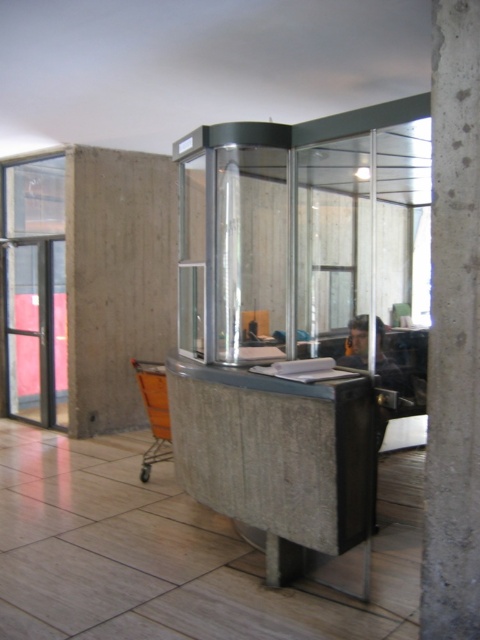
You are standing in the modern minimalist space and want to approach the glass booth. The point where you need to stand to be exactly 22.43 feet away from the booth is marked as point (28, 246). Can you confirm if this point is located to the left or right side of the booth?

The point (28, 246) is located to the left side of the booth as it is 22.43 feet away from the viewer, which matches the distance specified.

You are a delivery person carrying a large package and need to exit through the transparent glass door at left. There is an orange mesh shopping cart at lower left blocking your path. Can you walk around the shopping cart to reach the door?

The transparent glass door at left is further to the viewer than orange mesh shopping cart at lower left, meaning the shopping cart is closer to you. You can walk around the shopping cart to reach the door since the door is behind the cart.

Based on the photo, you are standing at the entrance of the reception area and want to move towards the booth. There are two points marked on the floor, point A at coordinates point(37, 298) and point B at coordinates point(169, 456). Which point should you step on first to reach the booth?

Point A at coordinates point(37, 298) is behind point B at coordinates point(169, 456), so you should step on point B first before reaching point A.